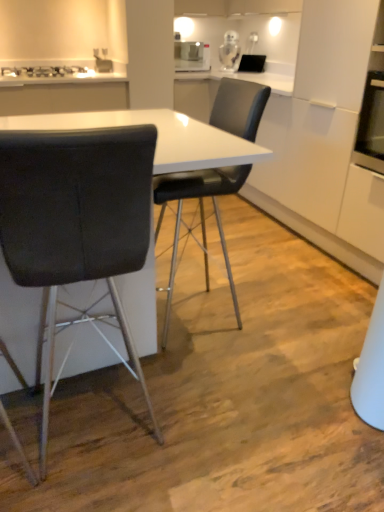
Where is `vacant location below black leather chair at left, which is counted as the first chair, starting from the left (from a real-world perspective)`? The width and height of the screenshot is (384, 512). vacant location below black leather chair at left, which is counted as the first chair, starting from the left (from a real-world perspective) is located at coordinates (108, 443).